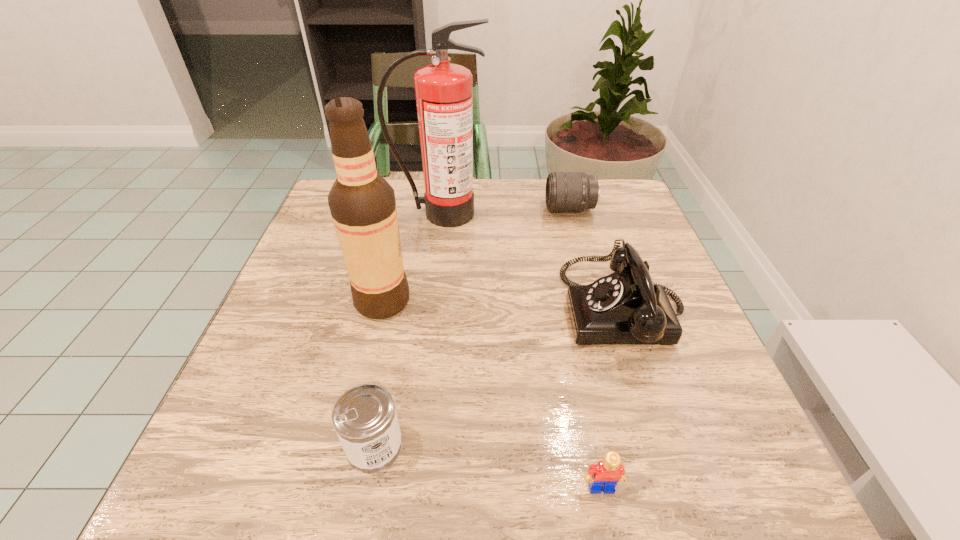
The width and height of the screenshot is (960, 540). In order to click on vacant point located between the telephoto lens and the nearest object in this screenshot , I will do `click(586, 348)`.

Locate an element on the screen. vacant space that's between the nearest object and the third tallest object is located at coordinates (612, 399).

Where is `vacant area between the alcohol and the telephone`? vacant area between the alcohol and the telephone is located at coordinates (503, 305).

Locate an element on the screen. free space between the telephone and the alcohol is located at coordinates (503, 305).

Locate an element on the screen. The height and width of the screenshot is (540, 960). empty location between the telephoto lens and the Lego is located at coordinates (586, 348).

Where is `free spot between the telephone and the Lego`? The height and width of the screenshot is (540, 960). free spot between the telephone and the Lego is located at coordinates (612, 399).

Where is `vacant area between the can and the third tallest object`? The image size is (960, 540). vacant area between the can and the third tallest object is located at coordinates [x=499, y=377].

The image size is (960, 540). What are the coordinates of `free area in between the alcohol and the fifth farthest object` in the screenshot? It's located at (378, 373).

This screenshot has width=960, height=540. Identify the location of vacant region between the alcohol and the fifth farthest object. (378, 373).

Locate which object is the closest to the third tallest object. Please provide its 2D coordinates. Your answer should be formatted as a tuple, i.e. [(x, y)], where the tuple contains the x and y coordinates of a point satisfying the conditions above.

[(565, 191)]